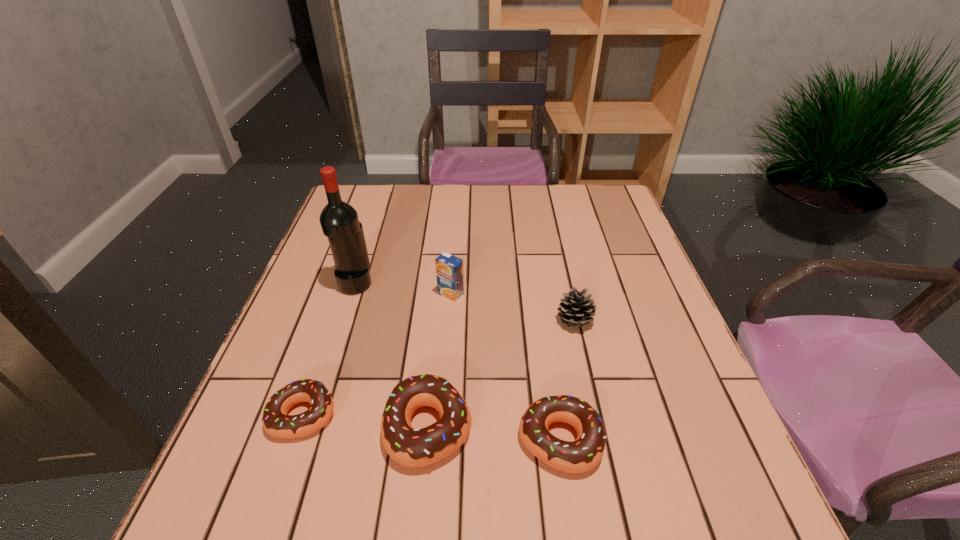
Where is `free space located on the right of the second doughnut from left to right`? free space located on the right of the second doughnut from left to right is located at coordinates (652, 427).

Locate an element on the screen. The height and width of the screenshot is (540, 960). free space located 0.330m on the back of the second shortest object is located at coordinates (538, 290).

The width and height of the screenshot is (960, 540). What are the coordinates of `free location located on the front of the fifth shortest object` in the screenshot? It's located at (441, 439).

At what (x,y) coordinates should I click in order to perform the action: click on free region located 0.290m on the back of the third farthest object. Please return your answer as a coordinate pair (x, y). Looking at the image, I should click on (556, 235).

The image size is (960, 540). What are the coordinates of `vacant space located on the back of the wine bottle` in the screenshot? It's located at (383, 198).

Identify the location of doughnut located at the left edge. Image resolution: width=960 pixels, height=540 pixels. (275, 421).

What are the coordinates of `wine bottle at the left edge` in the screenshot? It's located at (339, 221).

Where is `object that is at the near left corner`? Image resolution: width=960 pixels, height=540 pixels. object that is at the near left corner is located at coordinates (275, 421).

The width and height of the screenshot is (960, 540). I want to click on vacant area at the far edge of the desktop, so click(531, 201).

At what (x,y) coordinates should I click in order to perform the action: click on blank space at the near edge of the desktop. Please return your answer as a coordinate pair (x, y). Looking at the image, I should click on (524, 452).